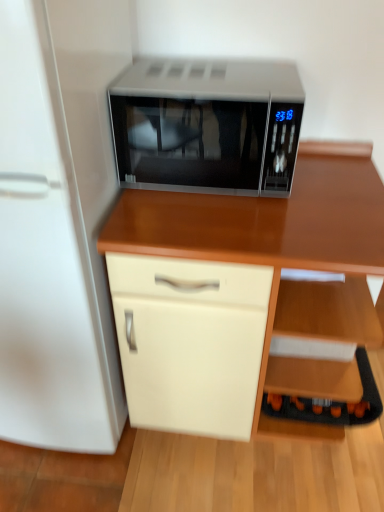
Identify the location of vacant area on top of sleek silver microwave at center (from a real-world perspective). The height and width of the screenshot is (512, 384). (217, 76).